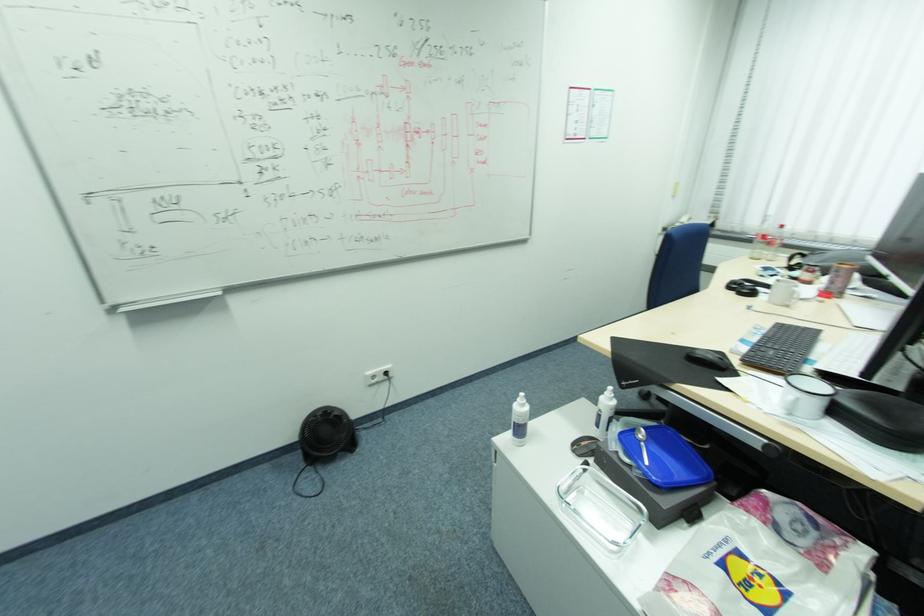
At what (x,y) coordinates should I click in order to perform the action: click on blue container lid. Please return your answer as a coordinate pair (x, y). The image size is (924, 616). Looking at the image, I should click on (663, 456).